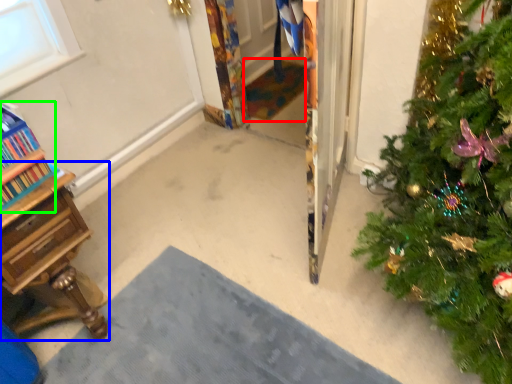
Question: Based on their relative distances, which object is nearer to doormat (highlighted by a red box)? Choose from desk (highlighted by a blue box) and bookcase (highlighted by a green box).

Choices:
 (A) desk
 (B) bookcase

Answer: (A)